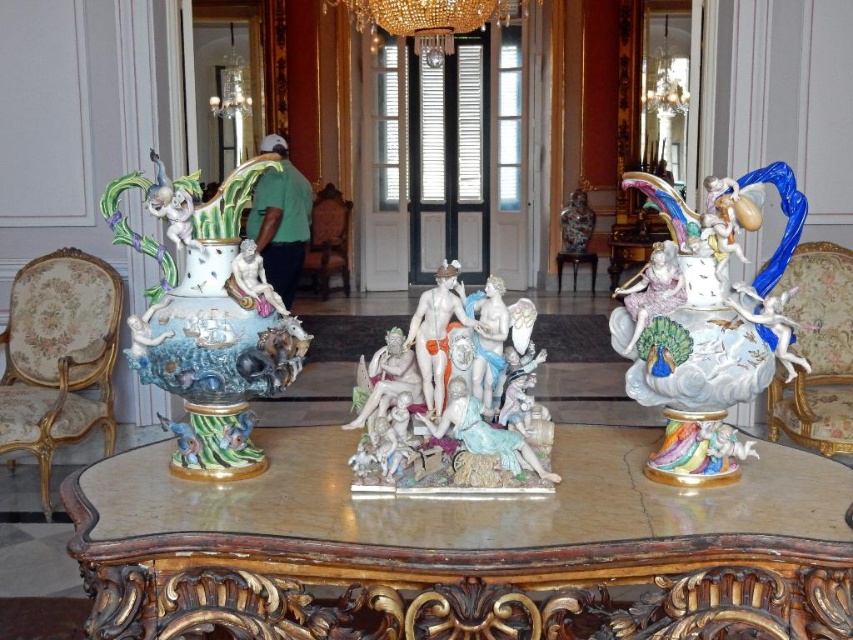
Who is higher up, crystal glass chandelier at upper center or porcelain vase at center?

porcelain vase at center is higher up.

Locate an element on the screen. The width and height of the screenshot is (853, 640). crystal glass chandelier at upper center is located at coordinates (428, 19).

Who is taller, wooden carved table at center or brown leather armchair at center?

brown leather armchair at center

Can you confirm if wooden carved table at center is positioned below brown leather armchair at center?

Yes.

Measure the distance between point [602,632] and camera.

1.73 meters

Identify the location of wooden carved table at center. (463, 548).

Is crystal glass chandelier at upper center positioned in front of brown leather armchair at center?

Yes, it is in front of brown leather armchair at center.

Is the position of crystal glass chandelier at upper center more distant than that of brown leather armchair at center?

No, crystal glass chandelier at upper center is in front of brown leather armchair at center.

This screenshot has height=640, width=853. Describe the element at coordinates (428, 19) in the screenshot. I see `crystal glass chandelier at upper center` at that location.

The height and width of the screenshot is (640, 853). What are the coordinates of `crystal glass chandelier at upper center` in the screenshot? It's located at (428, 19).